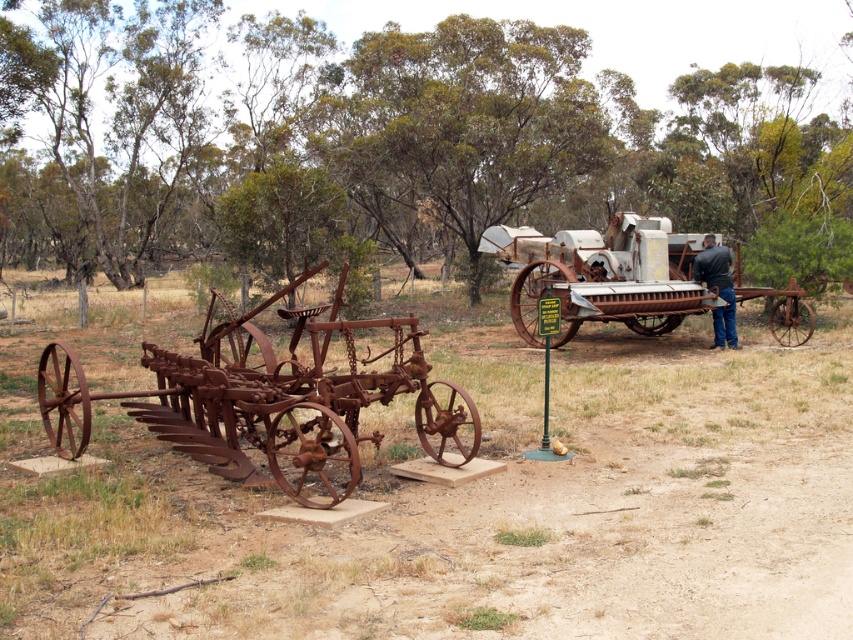
You are a farmer who wants to move the rusty metal plow at left closer to the tractor in the background. If you can carry the plow 4 meters in one trip, will you be able to move it to the tractor?

The distance between the rusty metal plow at left and the tractor is 3.98 meters. Since you can carry the plow 4 meters in one trip, you will be able to move it to the tractor as 4 meters is slightly more than the required distance.

You are a farmer trying to move both the rusty metal plow at left and the rusty metal tractor at left from their current positions. Based on their arrangement in the image, which one would require more effort to lift and move?

The rusty metal plow at left is positioned over the rusty metal tractor at left, meaning it is closer to the viewer. Since it is closer, it might be physically on top of the tractor, making it easier to lift first. However, without knowing their actual weights, we can only infer based on position. If the plow is above the tractor, moving the plow first would be necessary, but effort depends on weight and size which aren